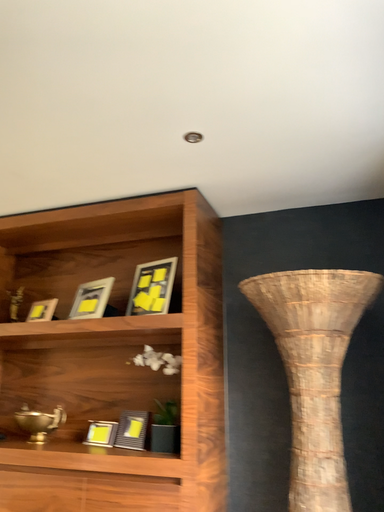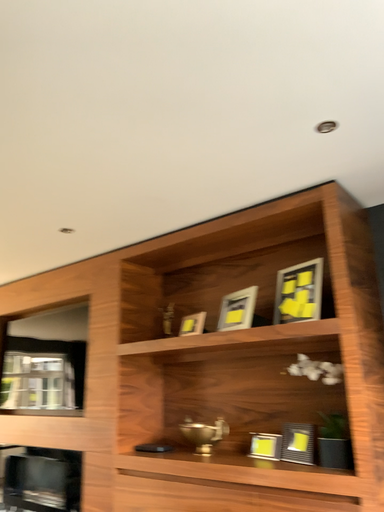
Question: Which way did the camera rotate in the video?

Choices:
 (A) rotated right
 (B) rotated left

Answer: (B)